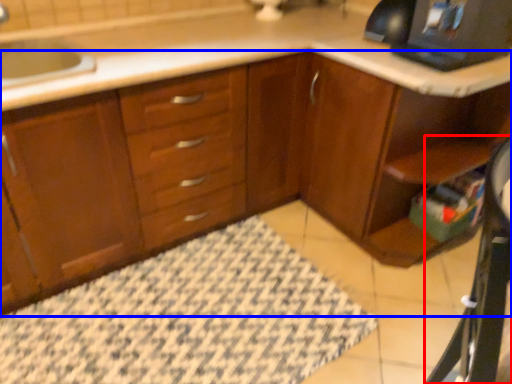
Question: Which point is closer to the camera, computer desk (highlighted by a red box) or cabinetry (highlighted by a blue box)?

Choices:
 (A) computer desk
 (B) cabinetry

Answer: (A)